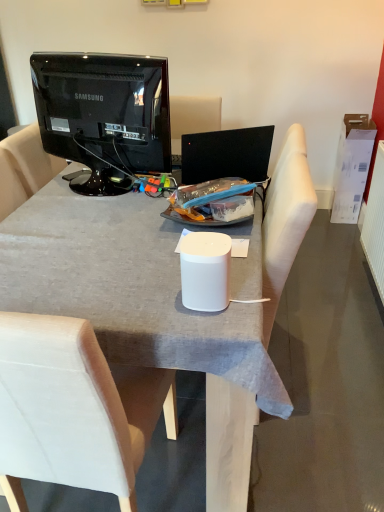
You are a GUI agent. You are given a task and a screenshot of the screen. Output one action in this format:
    pyautogui.click(x=<x>, y=<y>)
    Task: Click on the vacant space to the left of white matte smart speaker at center
    Image resolution: width=384 pixels, height=512 pixels.
    Given the screenshot: What is the action you would take?
    pyautogui.click(x=139, y=300)